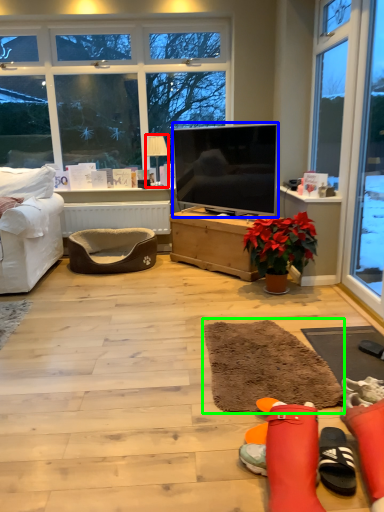
Question: Which object is the farthest from lamp (highlighted by a red box)? Choose among these: television (highlighted by a blue box) or flat (highlighted by a green box).

Choices:
 (A) television
 (B) flat

Answer: (B)